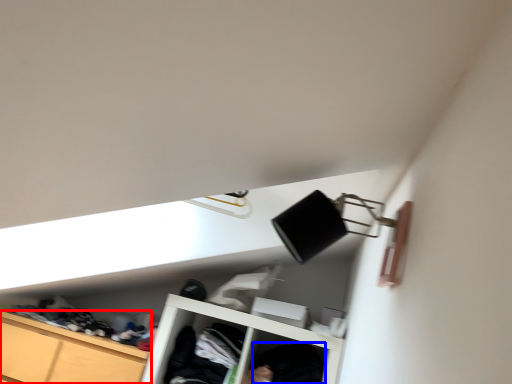
Question: Which object is further to the camera taking this photo, cabinetry (highlighted by a red box) or clothing (highlighted by a blue box)?

Choices:
 (A) cabinetry
 (B) clothing

Answer: (A)